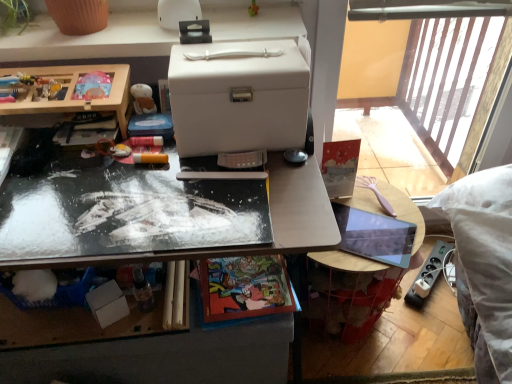
You are a GUI agent. You are given a task and a screenshot of the screen. Output one action in this format:
    pyautogui.click(x=<x>, y=<y>)
    Task: Click on the free spot above metallic reflective desk at center, which appears as the 3th desk when viewed from the top (from a real-world perspective)
    This screenshot has height=384, width=512.
    Given the screenshot: What is the action you would take?
    click(163, 292)